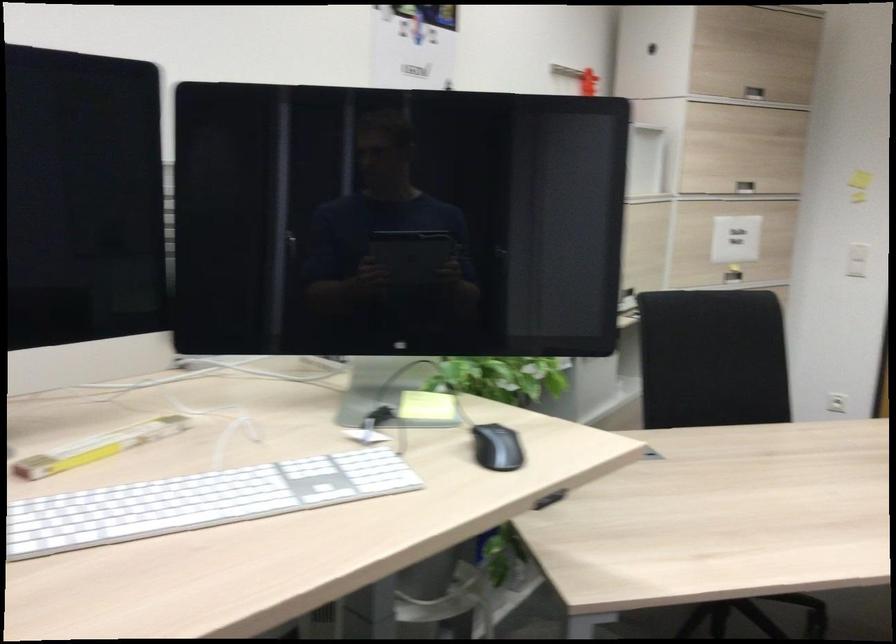
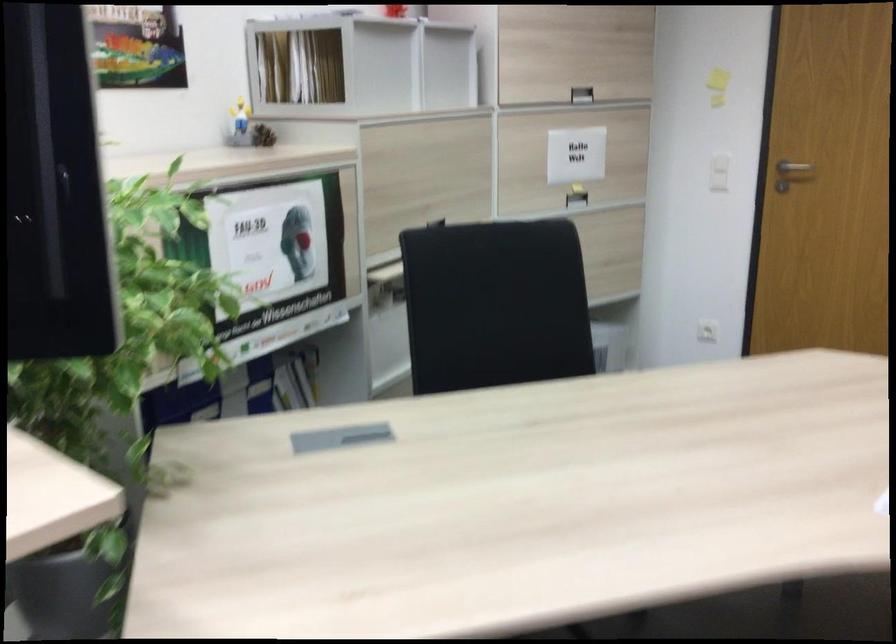
Question: Based on the continuous images, in which direction is the camera rotating? Reply with the corresponding letter.

Choices:
 (A) Left
 (B) Right
 (C) Up
 (D) Down

Answer: (D)